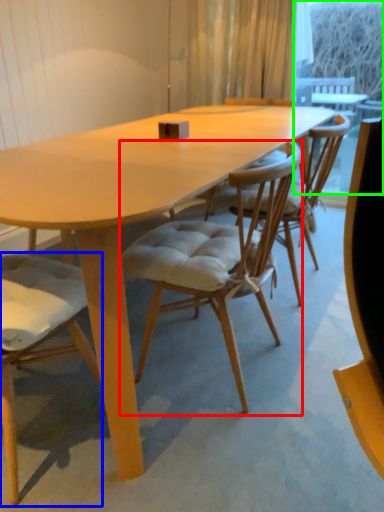
Question: Estimate the real-world distances between objects in this image. Which object is closer to chair (highlighted by a red box), chair (highlighted by a blue box) or window screen (highlighted by a green box)?

Choices:
 (A) chair
 (B) window screen

Answer: (A)